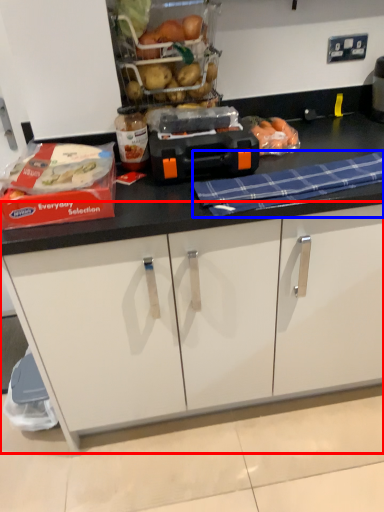
Question: Which point is further to the camera, cabinetry (highlighted by a red box) or blanket (highlighted by a blue box)?

Choices:
 (A) cabinetry
 (B) blanket

Answer: (A)